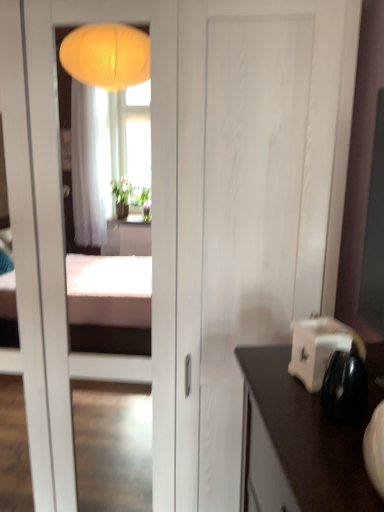
What do you see at coordinates (319, 348) in the screenshot? I see `white glossy toaster at right` at bounding box center [319, 348].

Measure the distance between white glossy toaster at right and camera.

A distance of 32.68 inches exists between white glossy toaster at right and camera.

Find the location of a particular element. white glossy toaster at right is located at coordinates (319, 348).

At what (x,y) coordinates should I click in order to perform the action: click on white matte door at center. Please return your answer as a coordinate pair (x, y). The width and height of the screenshot is (384, 512). Looking at the image, I should click on (x=253, y=205).

The width and height of the screenshot is (384, 512). What do you see at coordinates (253, 205) in the screenshot?
I see `white matte door at center` at bounding box center [253, 205].

In order to face white matte door at center, should I rotate leftwards or rightwards?

To align with it, rotate left about 9.573°.

Where is `white glossy toaster at right`? The height and width of the screenshot is (512, 384). white glossy toaster at right is located at coordinates (319, 348).

Which object is positioned more to the left, white matte door at center or white glossy toaster at right?

Positioned to the left is white matte door at center.

Is white matte door at center positioned behind white glossy toaster at right?

Yes, white matte door at center is behind white glossy toaster at right.

Between point (320, 123) and point (349, 346), which one is positioned in front?

The point (349, 346) is in front.

Consider the image. From the image's perspective, is white matte door at center above or below white glossy toaster at right?

white matte door at center is above white glossy toaster at right.

From a real-world perspective, relative to white glossy toaster at right, is white matte door at center vertically above or below?

In terms of real-world spatial position, white matte door at center is below white glossy toaster at right.

Between white matte door at center and white glossy toaster at right, which one has larger width?

white matte door at center.

From their relative heights in the image, would you say white matte door at center is taller or shorter than white glossy toaster at right?

white matte door at center is taller than white glossy toaster at right.

Looking at the image, does white matte door at center seem bigger or smaller compared to white glossy toaster at right?

In the image, white matte door at center appears to be larger than white glossy toaster at right.

Is white matte door at center positioned beyond the bounds of white glossy toaster at right?

Yes, white matte door at center is outside of white glossy toaster at right.

Is white matte door at center not near white glossy toaster at right?

No, there isn't a large distance between white matte door at center and white glossy toaster at right.

Could you tell me if white matte door at center is turned towards white glossy toaster at right?

Yes, white matte door at center is facing white glossy toaster at right.

Locate an element on the screen. appliance below the white matte door at center (from the image's perspective) is located at coordinates (319, 348).

Does white glossy toaster at right appear on the left side of white matte door at center?

No.

Is white glossy toaster at right in front of or behind white matte door at center in the image?

white glossy toaster at right is positioned closer to the viewer than white matte door at center.

Which is closer to the camera, (x=307, y=388) or (x=291, y=185)?

Point (x=307, y=388) is closer to the camera than point (x=291, y=185).

From the image's perspective, would you say white glossy toaster at right is positioned over white matte door at center?

No, from the image's perspective, white glossy toaster at right is not above white matte door at center.

From a real-world perspective, is white glossy toaster at right above or below white matte door at center?

In terms of real-world spatial position, white glossy toaster at right is above white matte door at center.

Looking at their sizes, would you say white glossy toaster at right is wider or thinner than white matte door at center?

white glossy toaster at right is thinner than white matte door at center.

Is white glossy toaster at right shorter than white matte door at center?

Correct, white glossy toaster at right is not as tall as white matte door at center.

Does white glossy toaster at right have a smaller size compared to white matte door at center?

Correct, white glossy toaster at right occupies less space than white matte door at center.

Would you say white glossy toaster at right is outside white matte door at center?

Absolutely, white glossy toaster at right is external to white matte door at center.

Is white glossy toaster at right next to white matte door at center?

No.

Is white glossy toaster at right facing towards white matte door at center?

No, white glossy toaster at right does not turn towards white matte door at center.

What's the angular difference between white glossy toaster at right and white matte door at center's facing directions?

The angle between the facing direction of white glossy toaster at right and the facing direction of white matte door at center is 69 degrees.

Measure the distance from white glossy toaster at right to white matte door at center.

white glossy toaster at right and white matte door at center are 57.47 centimeters apart.

What are the coordinates of `appliance that appears below the white matte door at center (from the image's perspective)` in the screenshot? It's located at (319, 348).

Identify the location of appliance that appears above the white matte door at center (from a real-world perspective). Image resolution: width=384 pixels, height=512 pixels. (319, 348).

In order to click on door above the white glossy toaster at right (from the image's perspective) in this screenshot , I will do `click(253, 205)`.